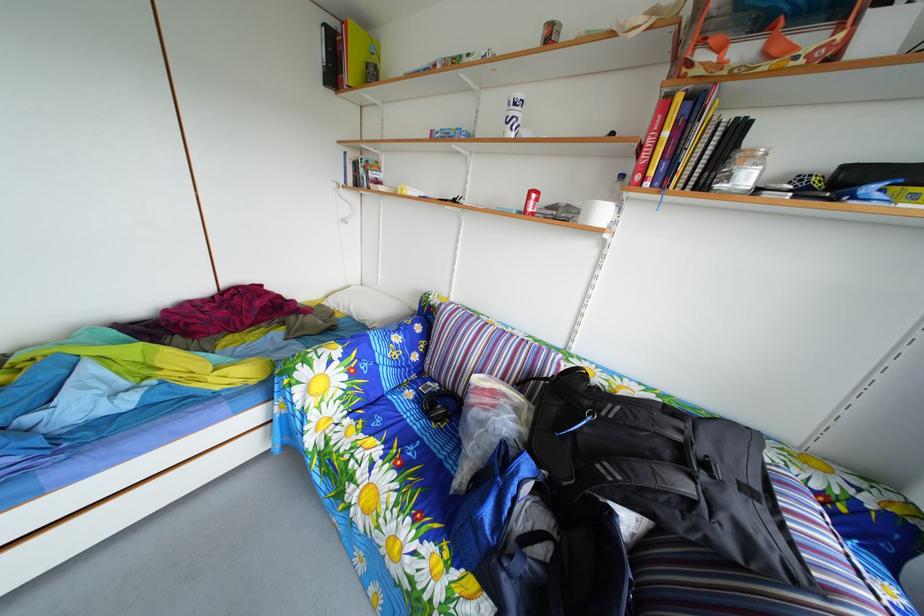
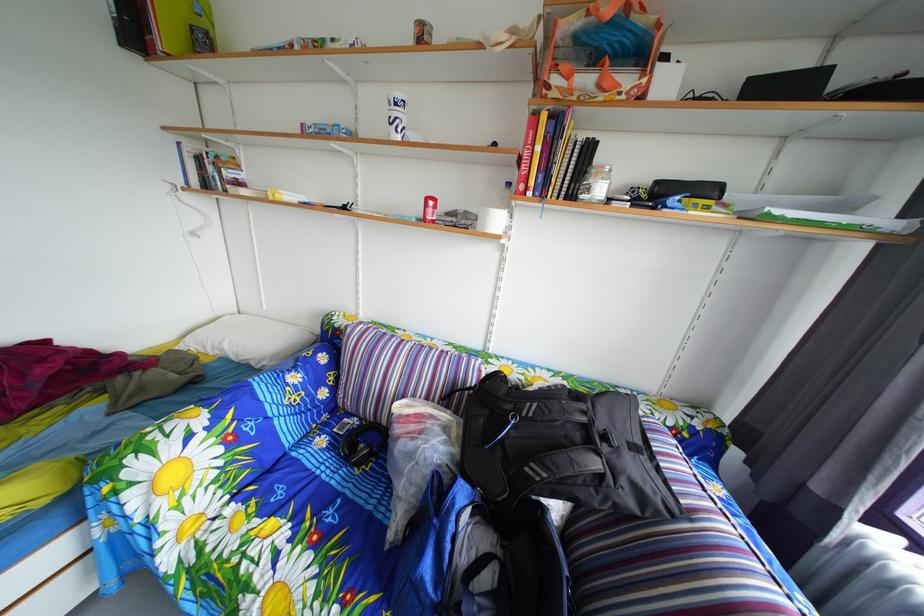
Find the pixel in the second image that matches pixel 757 498 in the first image.

(643, 456)